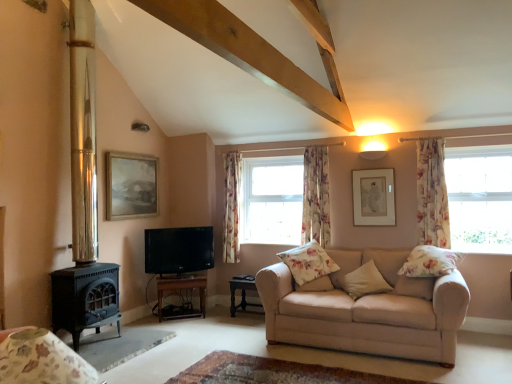
Question: From the image's perspective, is polished brass fireplace at left located above or below transparent glass window at right?

Choices:
 (A) above
 (B) below

Answer: (A)

Question: Considering the relative positions of polished brass fireplace at left and transparent glass window at right in the image provided, is polished brass fireplace at left to the left or to the right of transparent glass window at right?

Choices:
 (A) right
 (B) left

Answer: (B)

Question: Considering the real-world distances, which object is farthest from the beige fabric couch at lower right?

Choices:
 (A) floral fabric curtain at center, placed as the second curtain when sorted from left to right
 (B) matte wooden picture frame at upper left, the 2th picture frame viewed from the right
 (C) wooden tv stand at lower center, arranged as the first table when viewed from the left
 (D) black glossy tv at left
 (E) transparent glass window at right

Answer: (B)

Question: Which of these objects is positioned closest to the dark wood table at lower center, the 2th table from the left?

Choices:
 (A) beige fabric pillow at center, the third pillow viewed from the left
 (B) floral fabric pillow at right, the first pillow viewed from the right
 (C) matte wooden picture frame at upper left, the 2th picture frame viewed from the right
 (D) floral fabric curtain at center, arranged as the first curtain when viewed from the left
 (E) beige fabric couch at lower right

Answer: (D)